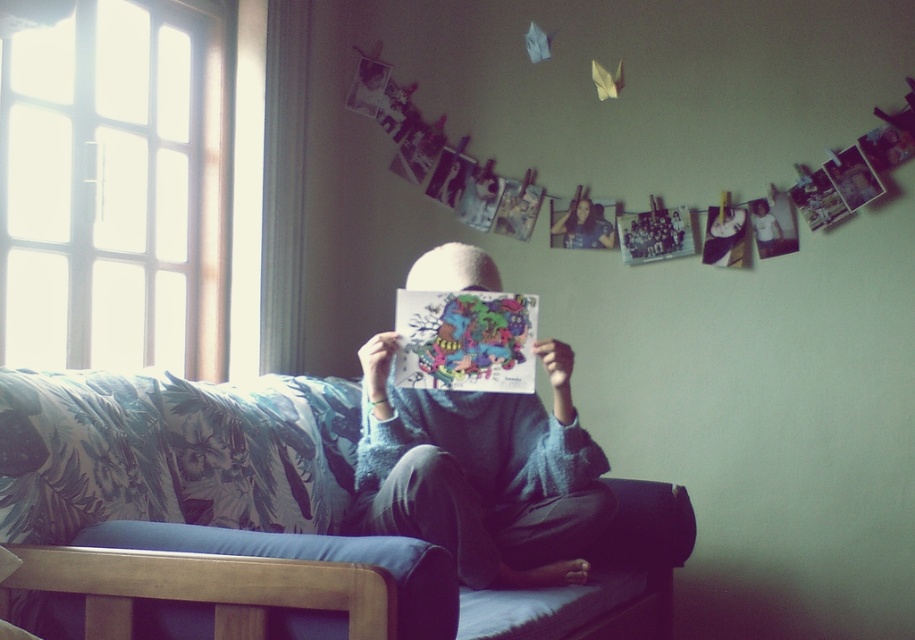
Who is taller, blue fabric couch at center or blue knitted sweater at center?

blue knitted sweater at center

Does blue fabric couch at center appear on the right side of blue knitted sweater at center?

No, blue fabric couch at center is not to the right of blue knitted sweater at center.

The image size is (915, 640). In order to click on blue fabric couch at center in this screenshot , I will do `click(276, 490)`.

Is point (440, 616) farther from camera compared to point (579, 198)?

No, (440, 616) is closer to viewer.

Can you confirm if blue fabric couch at center is shorter than smooth skin face at center?

Incorrect, blue fabric couch at center's height does not fall short of smooth skin face at center's.

Between point (47, 618) and point (576, 211), which one is positioned in front?

Positioned in front is point (47, 618).

The width and height of the screenshot is (915, 640). In order to click on blue fabric couch at center in this screenshot , I will do `click(276, 490)`.

How far apart are blue knitted sweater at center and smooth skin face at center?

The distance of blue knitted sweater at center from smooth skin face at center is 1.13 meters.

Between blue knitted sweater at center and smooth skin face at center, which one is positioned higher?

smooth skin face at center

Describe the element at coordinates (482, 474) in the screenshot. The height and width of the screenshot is (640, 915). I see `blue knitted sweater at center` at that location.

Find the location of `blue knitted sweater at center`. blue knitted sweater at center is located at coordinates (482, 474).